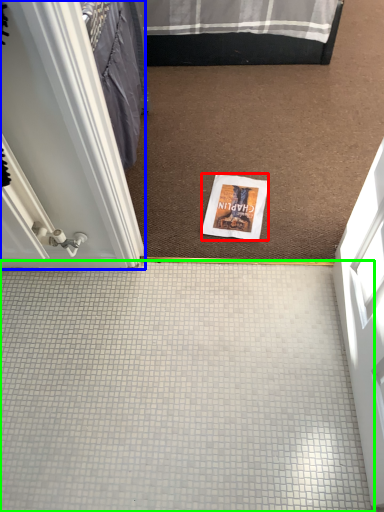
Question: Which object is the closest to the magazine (highlighted by a red box)? Choose among these: door (highlighted by a blue box) or plain (highlighted by a green box).

Choices:
 (A) door
 (B) plain

Answer: (B)